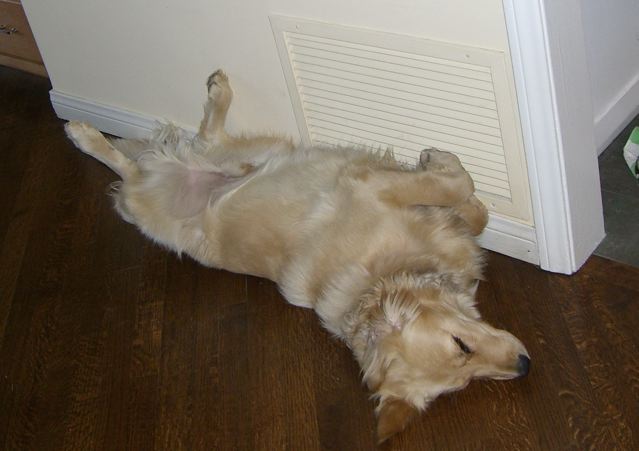
I want to click on carpet, so click(625, 201).